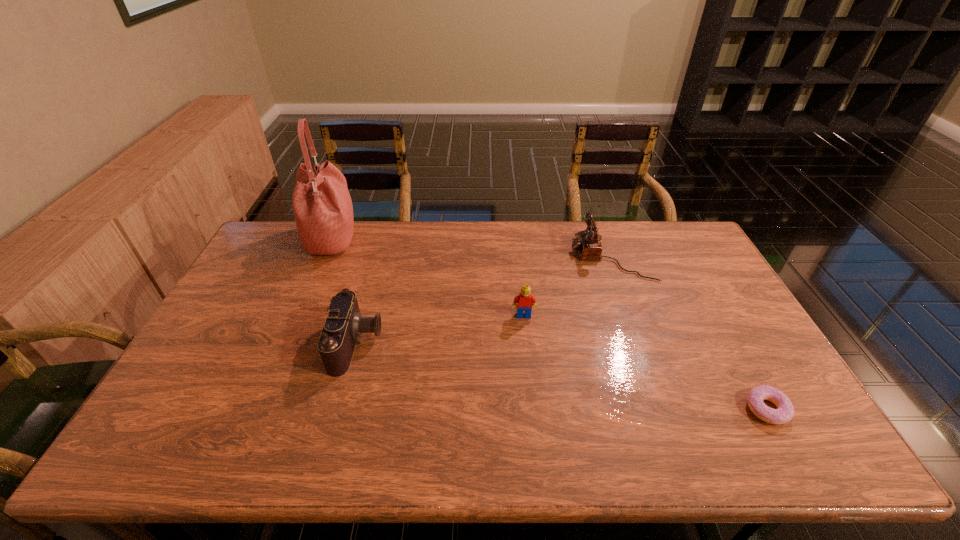
This screenshot has width=960, height=540. I want to click on object that is at the near right corner, so click(x=784, y=413).

What are the coordinates of `free space at the far edge` in the screenshot? It's located at (552, 220).

Find the location of `vacant space at the near edge of the desktop`. vacant space at the near edge of the desktop is located at coordinates (649, 448).

Image resolution: width=960 pixels, height=540 pixels. I want to click on free spot at the left edge of the desktop, so click(x=249, y=289).

In the image, there is a desktop. In order to click on vacant space at the far left corner in this screenshot , I will do `click(275, 256)`.

In the image, there is a desktop. At what (x,y) coordinates should I click in order to perform the action: click on free space at the far right corner. Please return your answer as a coordinate pair (x, y). This screenshot has height=540, width=960. Looking at the image, I should click on (681, 252).

The image size is (960, 540). Identify the location of free space between the second object from left to right and the rightmost object. (562, 376).

Find the location of a particular element. free point between the third object from left to right and the second object from left to right is located at coordinates (441, 329).

Where is `vacant space that is in between the third object from left to right and the leftmost object`? The image size is (960, 540). vacant space that is in between the third object from left to right and the leftmost object is located at coordinates (427, 278).

The height and width of the screenshot is (540, 960). I want to click on vacant point located between the doughnut and the third object from left to right, so click(x=645, y=362).